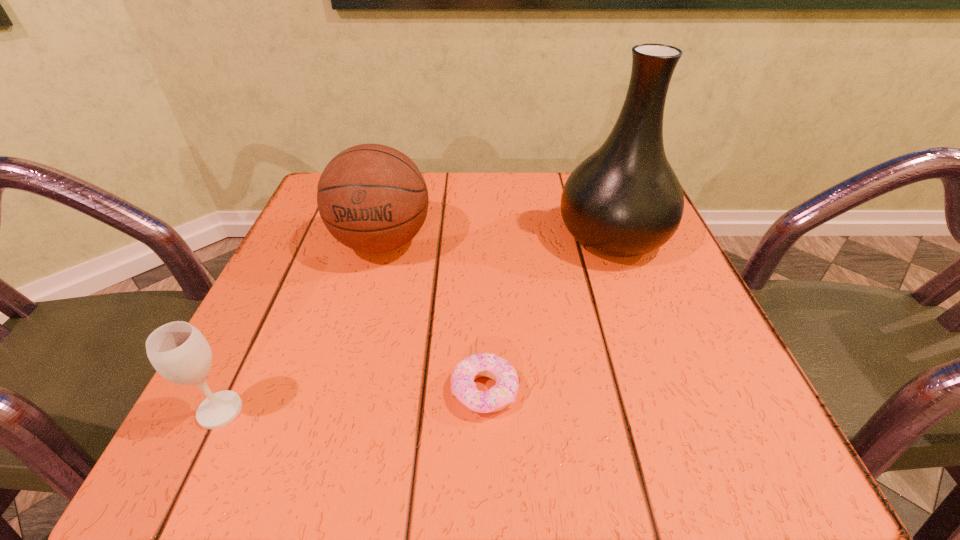
You are a GUI agent. You are given a task and a screenshot of the screen. Output one action in this format:
    pyautogui.click(x=<x>, y=<y>)
    Task: Click on the vacant area that lies between the tallest object and the leftmost object
    This screenshot has height=540, width=960.
    Given the screenshot: What is the action you would take?
    pyautogui.click(x=417, y=323)

I want to click on free space between the second tallest object and the rightmost object, so click(x=497, y=240).

The height and width of the screenshot is (540, 960). I want to click on free spot between the leftmost object and the second object from right to left, so click(x=352, y=401).

What are the coordinates of `vacant area between the basketball and the wineglass` in the screenshot? It's located at (301, 326).

The width and height of the screenshot is (960, 540). What are the coordinates of `free space between the second object from right to left and the second object from left to right` in the screenshot? It's located at (433, 316).

The image size is (960, 540). Identify the location of object that can be found as the second closest to the vase. (x=372, y=198).

You are a GUI agent. You are given a task and a screenshot of the screen. Output one action in this format:
    pyautogui.click(x=<x>, y=<y>)
    Task: Click on the second closest object to the shortest object
    The width and height of the screenshot is (960, 540).
    Given the screenshot: What is the action you would take?
    pyautogui.click(x=624, y=200)

You are a GUI agent. You are given a task and a screenshot of the screen. Output one action in this format:
    pyautogui.click(x=<x>, y=<y>)
    Task: Click on the vacant point that satisfies the following two spatial constraints: 1. on the side with brand label of the doughnut; 2. on the left side of the second object from left to right
    The height and width of the screenshot is (540, 960).
    Given the screenshot: What is the action you would take?
    pyautogui.click(x=342, y=391)

Find the location of `vacant region that satisfies the following two spatial constraints: 1. on the side with brand label of the shortest object; 2. on the right side of the basketball`. vacant region that satisfies the following two spatial constraints: 1. on the side with brand label of the shortest object; 2. on the right side of the basketball is located at coordinates (342, 391).